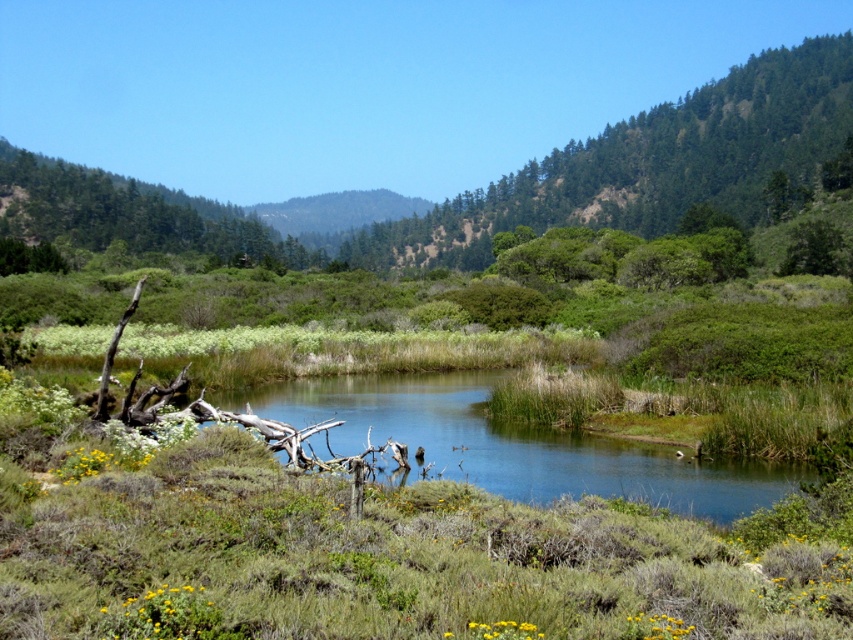
Question: Observing the image, what is the correct spatial positioning of green leafy tree at upper center in reference to clear water at center?

Choices:
 (A) above
 (B) below

Answer: (A)

Question: Among these objects, which one is nearest to the camera?

Choices:
 (A) green leafy tree at upper center
 (B) green leafy tree at upper left
 (C) clear water at center

Answer: (C)

Question: Which point is farther to the camera?

Choices:
 (A) green leafy tree at upper left
 (B) green leafy tree at upper center

Answer: (B)

Question: Is green leafy tree at upper left further to camera compared to green leafy tree at upper right?

Choices:
 (A) no
 (B) yes

Answer: (B)

Question: Can you confirm if green leafy tree at upper center is bigger than green leafy tree at upper right?

Choices:
 (A) no
 (B) yes

Answer: (B)

Question: Which point is closer to the camera taking this photo?

Choices:
 (A) (512, 193)
 (B) (822, 244)

Answer: (B)